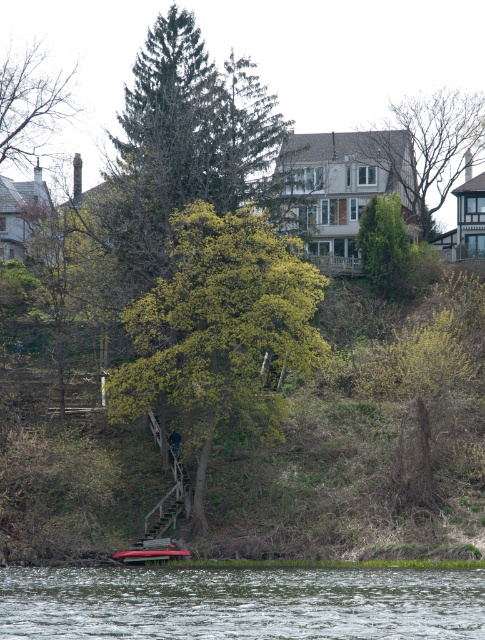
You are standing at the camera position observing the serene riverside scene. There is a point marked at coordinates point (402, 243). Can you determine if this point is within a safe distance for a drone to land?

The point (402, 243) is 82.51 meters away from the camera. Since drones typically require a minimum landing distance of about 50 meters, this point is within a safe distance for a drone to land.

You are standing at the riverside and want to know which object is taller between the clear water at lower center and the green textured evergreen tree at center. Which one is taller?

The green textured evergreen tree at center is taller than the clear water at lower center.

You are standing on the wooden dock and want to take a photo of both the green leafy tree at center and the clear water at lower center. Which object should you frame first in your camera to ensure both are fully visible in the photo?

You should frame the green leafy tree at center first because it is bigger than the clear water at lower center, so ensuring it fits will naturally include the smaller clear water at lower center in the shot.